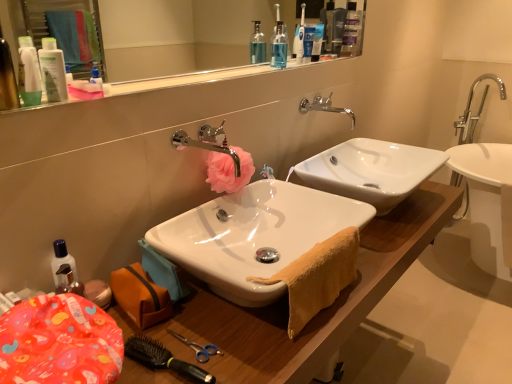
Question: In which direction should I rotate to look at transparent plastic mouthwash at upper center?

Choices:
 (A) right
 (B) left

Answer: (A)

Question: Is the surface of pink fabric flower at center in direct contact with white plastic toothpaste tube at upper center, which appears as the 3th toiletry when viewed from the left?

Choices:
 (A) yes
 (B) no

Answer: (B)

Question: Can you confirm if pink fabric flower at center is thinner than white plastic toothpaste tube at upper center, which is the 3th toiletry from front to back?

Choices:
 (A) yes
 (B) no

Answer: (B)

Question: Is white plastic toothpaste tube at upper center, which ranks as the 1th toiletry in top-to-bottom order, located within pink fabric flower at center?

Choices:
 (A) no
 (B) yes

Answer: (A)

Question: Does pink fabric flower at center have a lesser height compared to white plastic toothpaste tube at upper center, positioned as the 1th toiletry in back-to-front order?

Choices:
 (A) no
 (B) yes

Answer: (B)

Question: Is pink fabric flower at center looking in the opposite direction of white plastic toothpaste tube at upper center, which ranks as the 1th toiletry in top-to-bottom order?

Choices:
 (A) no
 (B) yes

Answer: (A)

Question: From a real-world perspective, is pink fabric flower at center beneath white plastic toothpaste tube at upper center, the third toiletry from the bottom?

Choices:
 (A) no
 (B) yes

Answer: (B)

Question: Is black rubber brush at lower left, which is the first brush in front-to-back order, thinner than matte plastic container at lower left?

Choices:
 (A) no
 (B) yes

Answer: (B)

Question: From the image's perspective, does black rubber brush at lower left, which is the first brush in front-to-back order, appear higher than matte plastic container at lower left?

Choices:
 (A) no
 (B) yes

Answer: (A)

Question: Is black rubber brush at lower left, which is the first brush in front-to-back order, facing away from matte plastic container at lower left?

Choices:
 (A) no
 (B) yes

Answer: (A)

Question: Is black rubber brush at lower left, which is the first brush in front-to-back order, shorter than matte plastic container at lower left?

Choices:
 (A) yes
 (B) no

Answer: (A)

Question: Can you confirm if black rubber brush at lower left, the 2th brush in the back-to-front sequence, is wider than matte plastic container at lower left?

Choices:
 (A) no
 (B) yes

Answer: (A)

Question: Is black rubber brush at lower left, the 2th brush in the back-to-front sequence, smaller than matte plastic container at lower left?

Choices:
 (A) no
 (B) yes

Answer: (B)

Question: Could you tell me if matte white lotion at upper left, which ranks as the 3th toiletry in top-to-bottom order, is facing matte plastic container at lower left?

Choices:
 (A) no
 (B) yes

Answer: (A)